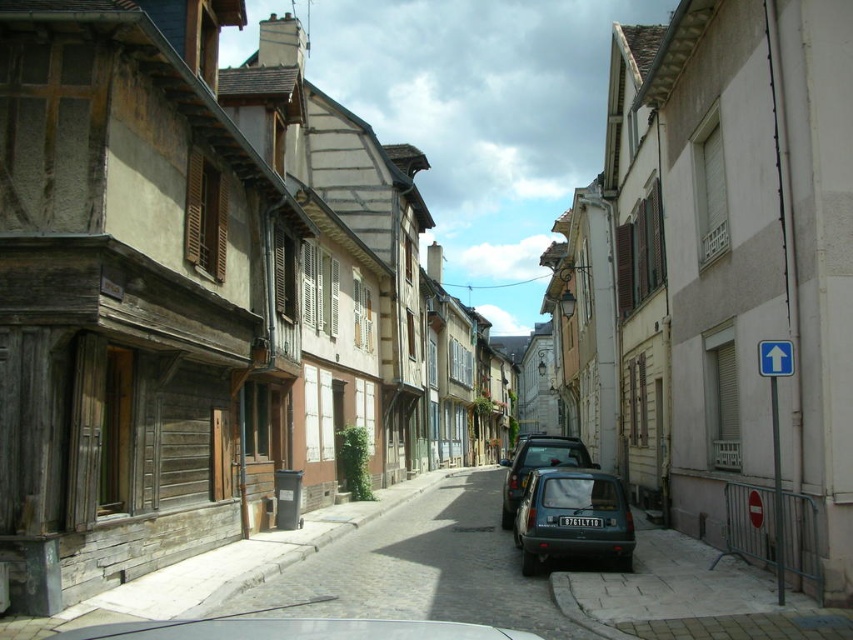
Based on the photo, is matte black car at center thinner than black plastic license plate at center?

No, matte black car at center is not thinner than black plastic license plate at center.

Measure the distance between point (525, 484) and camera.

The distance of point (525, 484) from camera is 14.79 meters.

Image resolution: width=853 pixels, height=640 pixels. Describe the element at coordinates (537, 465) in the screenshot. I see `matte black car at center` at that location.

Locate an element on the screen. matte black car at center is located at coordinates (537, 465).

Is point (532, 563) positioned before point (585, 467)?

Yes.

Who is shorter, matte dark green car at center or matte black car at center?

matte dark green car at center is shorter.

Where is `matte dark green car at center`? The image size is (853, 640). matte dark green car at center is located at coordinates (572, 515).

Is matte dark green car at center wider than black plastic license plate at center?

Yes, matte dark green car at center is wider than black plastic license plate at center.

Does matte dark green car at center have a smaller size compared to black plastic license plate at center?

Incorrect, matte dark green car at center is not smaller in size than black plastic license plate at center.

Which is behind, point (572, 470) or point (560, 516)?

The point (572, 470) is behind.

Where is `matte dark green car at center`? matte dark green car at center is located at coordinates (572, 515).